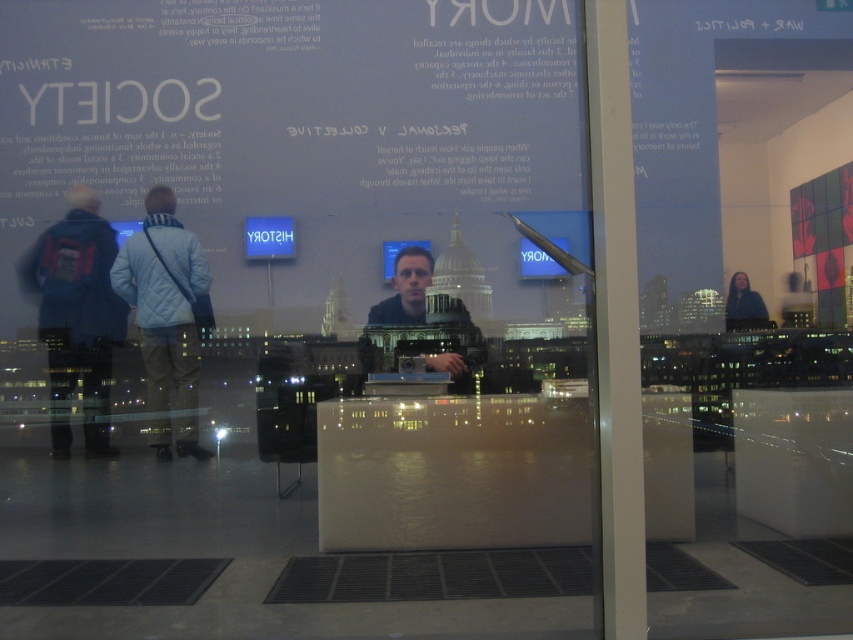
You are an observer standing in the gallery looking at the jackets displayed on the table. Which jacket is positioned lower on the table between the denim jacket at left and the dark blue jacket at right?

The denim jacket at left is positioned lower on the table than the dark blue jacket at right.

You are standing in the gallery and see two jackets hanging on a rack at the left side of the room. Which jacket is nearer to you, the denim jacket at left or the light blue quilted jacket at left?

The denim jacket at left is closer to the viewer than the light blue quilted jacket at left, so the denim jacket at left is nearer.

What is the spatial relationship between the transparent glass door at right and the dark blue jacket at right in the scene?

The transparent glass door at right is in front of the dark blue jacket at right, meaning the jacket is positioned behind the door.